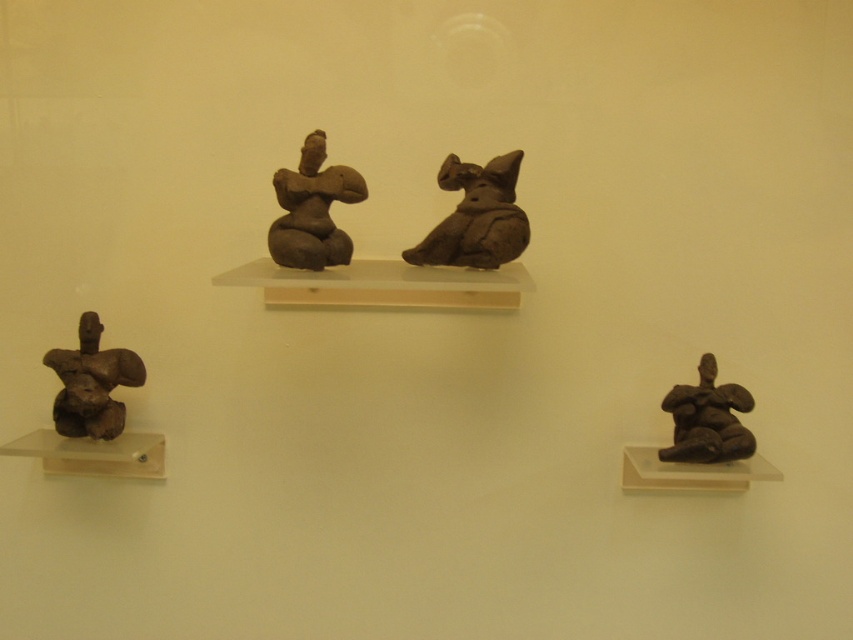
Question: Which is nearer to the matte brown statue at lower left?

Choices:
 (A) matte clay figure at center
 (B) matte brown figure at lower right

Answer: (A)

Question: Is matte clay cat at center to the right of matte clay figure at center from the viewer's perspective?

Choices:
 (A) no
 (B) yes

Answer: (B)

Question: Which point is farther from the camera taking this photo?

Choices:
 (A) (107, 440)
 (B) (276, 236)
 (C) (440, 237)
 (D) (669, 394)

Answer: (D)

Question: Is matte clay cat at center positioned at the back of matte clay figure at center?

Choices:
 (A) no
 (B) yes

Answer: (B)

Question: Is matte clay cat at center below matte brown statue at lower left?

Choices:
 (A) yes
 (B) no

Answer: (B)

Question: Which object is the closest to the matte brown figure at lower right?

Choices:
 (A) matte clay cat at center
 (B) matte clay figure at center

Answer: (A)